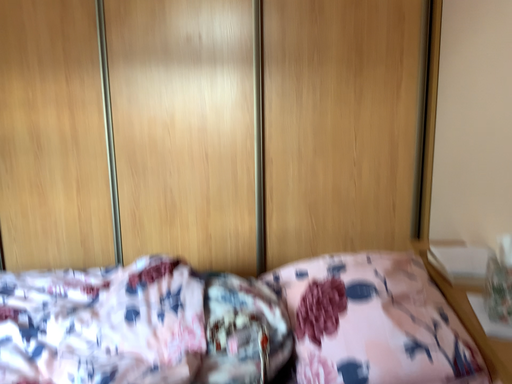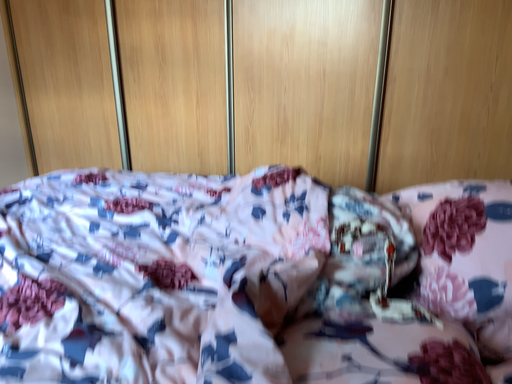
Question: Which way did the camera rotate in the video?

Choices:
 (A) rotated downward
 (B) rotated upward

Answer: (A)